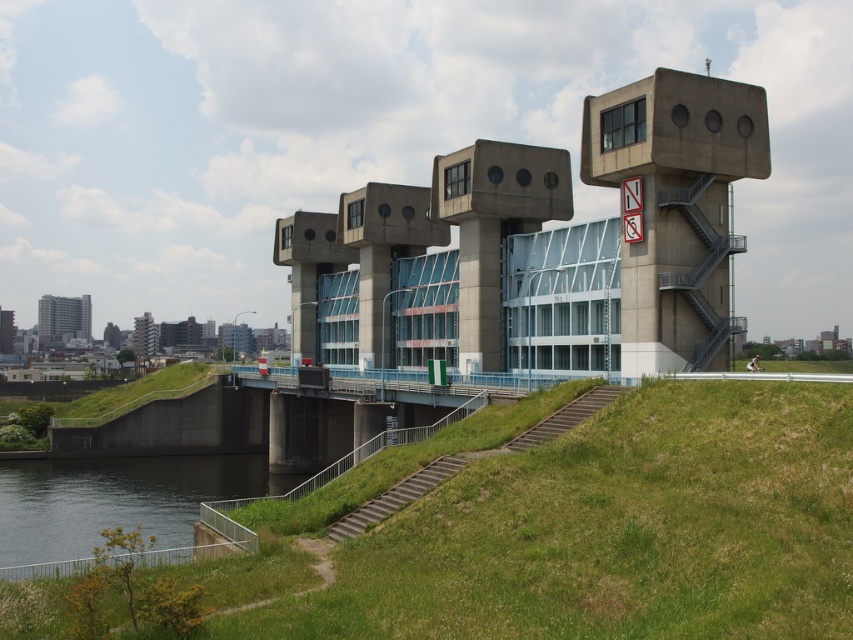
You are standing at the base of the structure and want to cross to the elevated walkway. You see the green grassy at lower center and the dark gray concrete river at lower left. Which path should you take to avoid getting wet?

You should take the green grassy at lower center because it is to the right of the dark gray concrete river at lower left, which is likely the actual waterway. The grassy area is more likely dry and safe for crossing.

You are standing at the base of the architectural structure near the water. You see two points marked on the building. One is at coordinate point (656, 573) and the other at point (347, 369). If you were to walk towards the building, which point would you encounter first?

Point (656, 573) is in front of point (347, 369), so you would encounter point (656, 573) first when approaching the building.